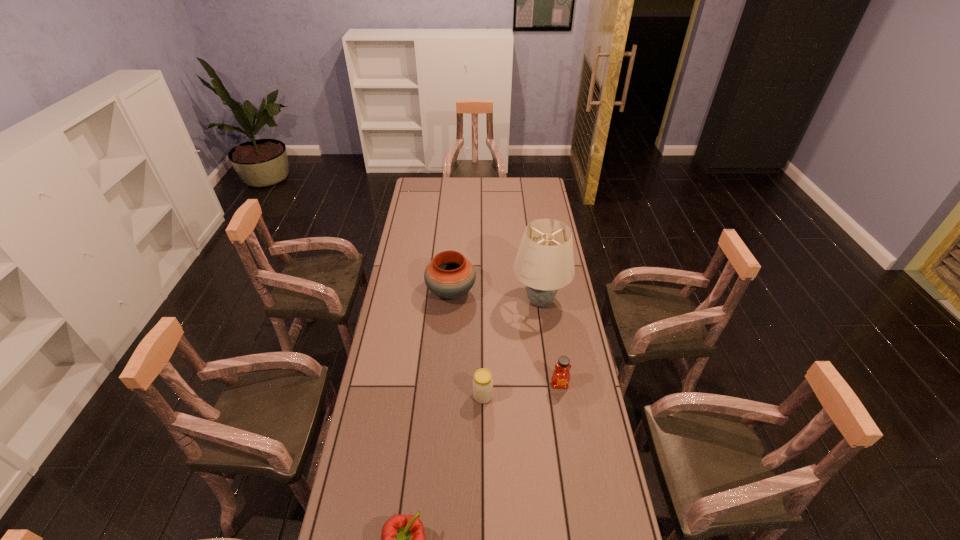
At what (x,y) coordinates should I click in order to perform the action: click on the tallest object. Please return your answer as a coordinate pair (x, y). The width and height of the screenshot is (960, 540). Looking at the image, I should click on (544, 263).

The image size is (960, 540). I want to click on pottery, so click(450, 275).

The height and width of the screenshot is (540, 960). I want to click on honey, so click(x=560, y=379).

Locate an element on the screen. jar is located at coordinates (482, 382).

At what (x,y) coordinates should I click in order to perform the action: click on free space located 0.050m on the back of the tallest object. Please return your answer as a coordinate pair (x, y). This screenshot has width=960, height=540. Looking at the image, I should click on (536, 275).

Identify the location of vacant space located on the front of the second tallest object. (445, 374).

This screenshot has width=960, height=540. Find the location of `vacant space located 0.140m on the front label of the honey`. vacant space located 0.140m on the front label of the honey is located at coordinates (566, 427).

The height and width of the screenshot is (540, 960). I want to click on free spot located 0.110m on the front of the jar, so click(483, 434).

Locate an element on the screen. This screenshot has height=540, width=960. lampshade positioned at the right edge is located at coordinates (544, 263).

Where is `honey present at the right edge`? Image resolution: width=960 pixels, height=540 pixels. honey present at the right edge is located at coordinates (560, 379).